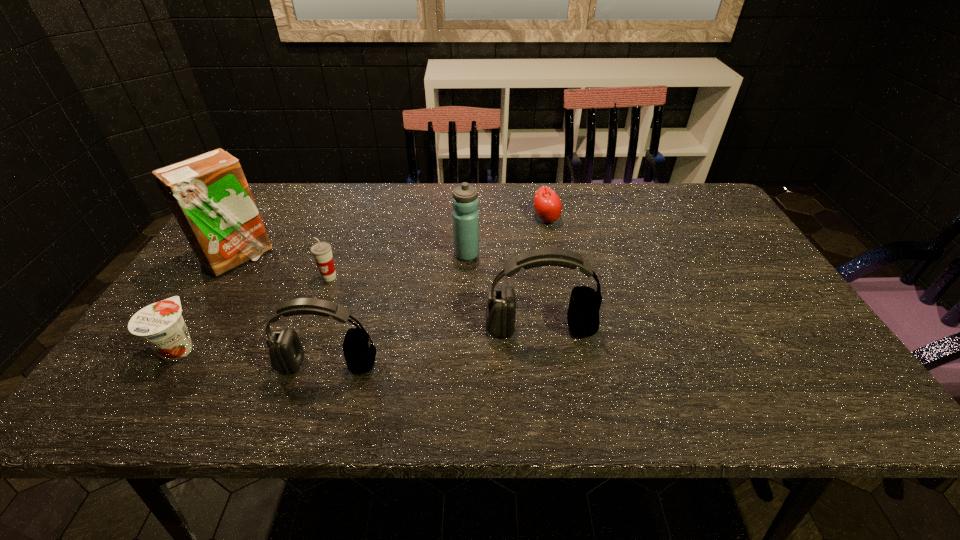
Locate an element on the screen. The height and width of the screenshot is (540, 960). free location located 0.230m on the straw side of the tallest object is located at coordinates (353, 258).

Image resolution: width=960 pixels, height=540 pixels. Find the location of `free region located 0.140m on the back of the apple`. free region located 0.140m on the back of the apple is located at coordinates (540, 186).

In order to click on free region located 0.060m on the side of the fifth tallest object with the logo in this screenshot , I will do `click(321, 300)`.

The width and height of the screenshot is (960, 540). In order to click on free space located on the front of the third object from right to left in this screenshot , I will do `click(466, 293)`.

At what (x,y) coordinates should I click in order to perform the action: click on vacant region located 0.280m on the right of the yogurt. Please return your answer as a coordinate pair (x, y). This screenshot has height=540, width=960. Looking at the image, I should click on (326, 347).

Locate an element on the screen. The image size is (960, 540). object present at the far edge is located at coordinates (547, 204).

This screenshot has width=960, height=540. Identify the location of yogurt present at the near edge. (160, 325).

Locate an element on the screen. carton that is at the left edge is located at coordinates (208, 194).

Find the location of a particular element. This screenshot has width=960, height=540. yogurt situated at the left edge is located at coordinates (160, 325).

In order to click on object that is at the near left corner in this screenshot , I will do `click(160, 325)`.